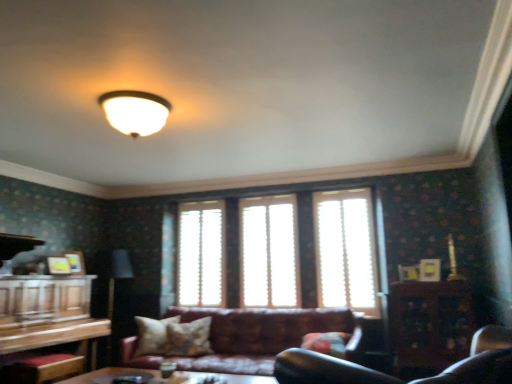
Question: From a real-world perspective, is patterned fabric pillow at center, positioned as the second pillow in left-to-right order, physically located above or below fluffy fabric pillow at lower center, which ranks as the 1th pillow in right-to-left order?

Choices:
 (A) below
 (B) above

Answer: (B)

Question: Considering the positions of patterned fabric pillow at center, marked as the 2th pillow in a right-to-left arrangement, and fluffy fabric pillow at lower center, which ranks as the 1th pillow in right-to-left order, in the image, is patterned fabric pillow at center, marked as the 2th pillow in a right-to-left arrangement, taller or shorter than fluffy fabric pillow at lower center, which ranks as the 1th pillow in right-to-left order,?

Choices:
 (A) tall
 (B) short

Answer: (A)

Question: Based on their relative distances, which object is farther from the white wood blinds at center, the 3th window positioned from the left?

Choices:
 (A) patterned fabric pillow at center, positioned as the second pillow in left-to-right order
 (B) translucent wood blinds at center, placed as the second window when sorted from right to left
 (C) wooden entertainment center at left
 (D) wooden cabinet at right
 (E) fluffy fabric pillow at lower center, the 3th pillow viewed from the left

Answer: (C)

Question: Estimate the real-world distances between objects in this image. Which object is closer to the patterned fabric pillow at center, positioned as the second pillow in left-to-right order?

Choices:
 (A) wooden cabinet at right
 (B) leather couch at center
 (C) white wood blinds at center, which ranks as the 1th window in right-to-left order
 (D) wooden entertainment center at left
 (E) translucent wood blinds at center, placed as the second window when sorted from right to left

Answer: (B)